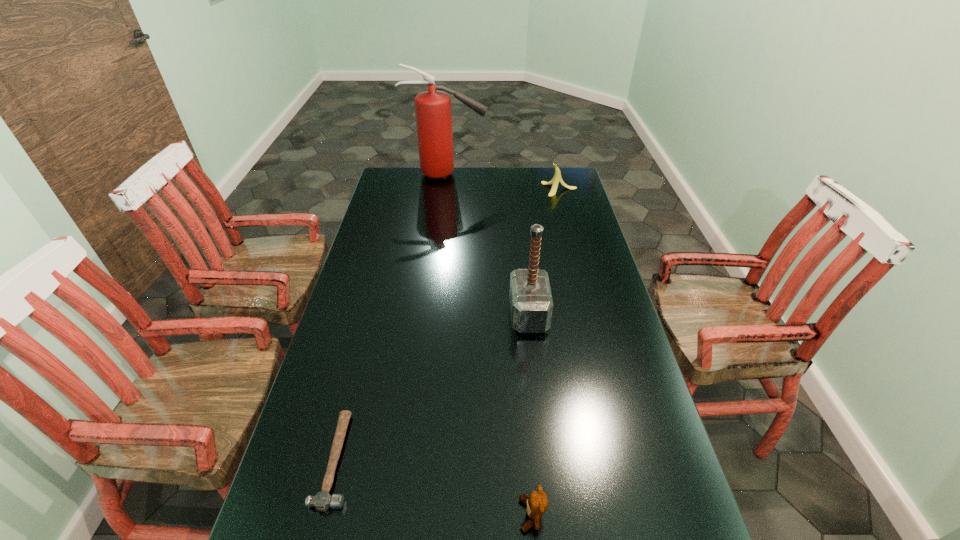
This screenshot has width=960, height=540. Find the location of `free spot located 0.090m on the front of the third shortest object`. free spot located 0.090m on the front of the third shortest object is located at coordinates (565, 208).

Image resolution: width=960 pixels, height=540 pixels. What are the coordinates of `vacant space located 0.300m on the front-facing side of the fourth tallest object` in the screenshot? It's located at (376, 514).

Find the location of a particular element. The height and width of the screenshot is (540, 960). vacant space located 0.120m on the front-facing side of the fourth tallest object is located at coordinates (463, 514).

This screenshot has height=540, width=960. What are the coordinates of `blank area located 0.280m on the front-facing side of the fourth tallest object` in the screenshot? It's located at (386, 514).

Find the location of `vacant space situated on the striking face of the shorter hammer`. vacant space situated on the striking face of the shorter hammer is located at coordinates (436, 460).

Find the location of `fire extinguisher at the far edge`. fire extinguisher at the far edge is located at coordinates (433, 111).

The width and height of the screenshot is (960, 540). What are the coordinates of `banana located in the far edge section of the desktop` in the screenshot? It's located at (557, 178).

Where is `fire extinguisher located in the left edge section of the desktop`? Image resolution: width=960 pixels, height=540 pixels. fire extinguisher located in the left edge section of the desktop is located at coordinates (433, 111).

This screenshot has height=540, width=960. Find the location of `hammer situated at the left edge`. hammer situated at the left edge is located at coordinates (322, 501).

Where is `object that is at the right edge`? object that is at the right edge is located at coordinates (557, 178).